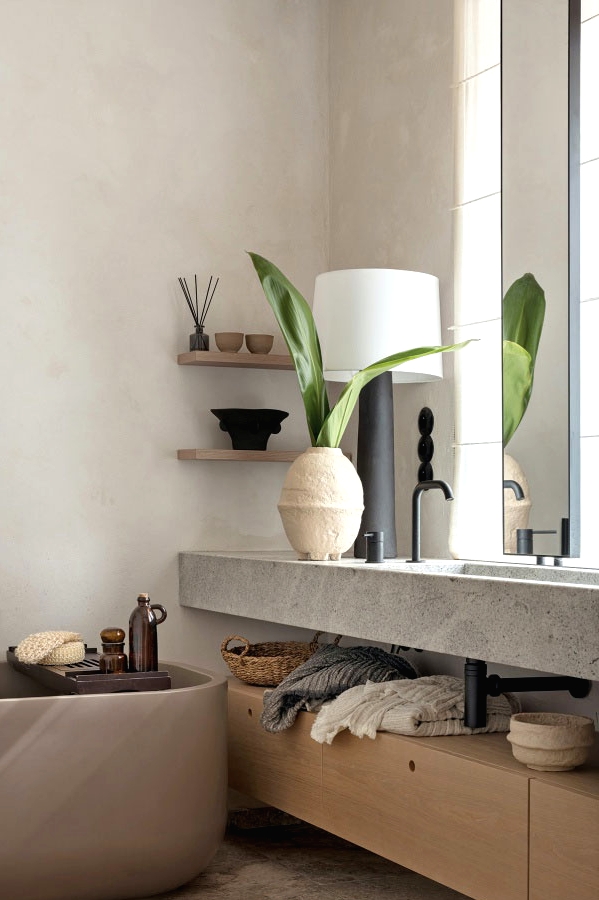
Identify the location of tall mirror. The image size is (599, 900). (556, 231).